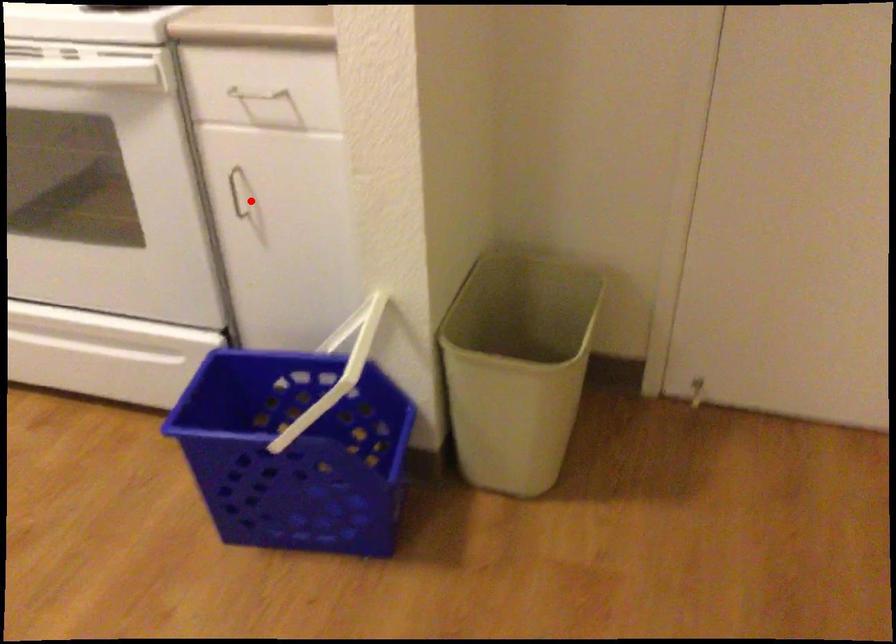
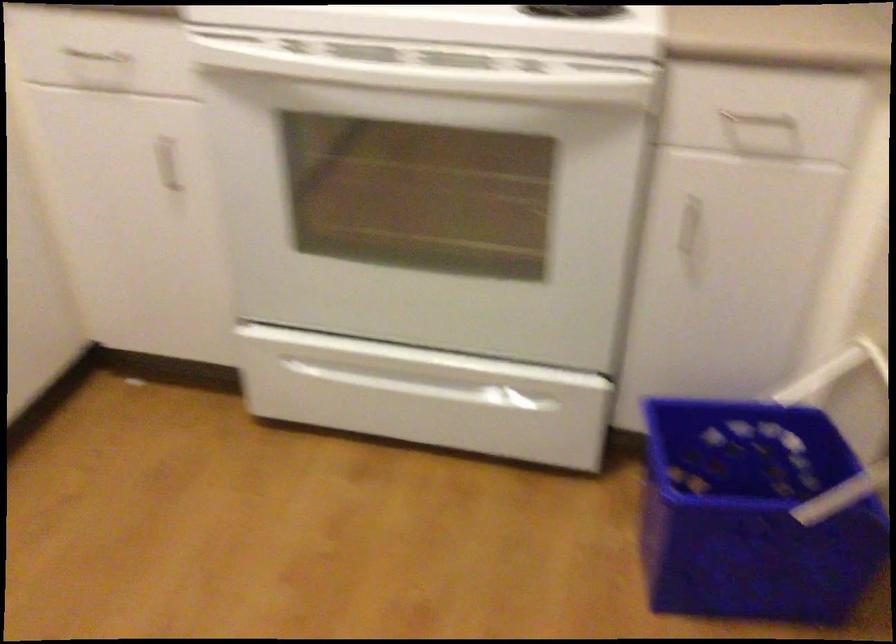
Question: I am providing you with two images of the same scene from different viewpoints. Image1 has a red point marked. In image2, the corresponding 3D location appears at what relative position? Reply with the corresponding letter.

Choices:
 (A) Closer
 (B) Farther

Answer: (A)